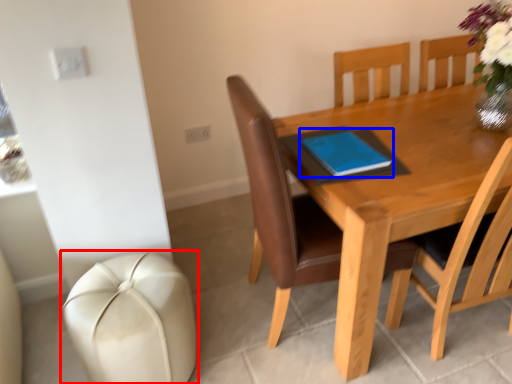
Question: Which point is further to the camera, swivel chair (highlighted by a red box) or notebook (highlighted by a blue box)?

Choices:
 (A) swivel chair
 (B) notebook

Answer: (B)